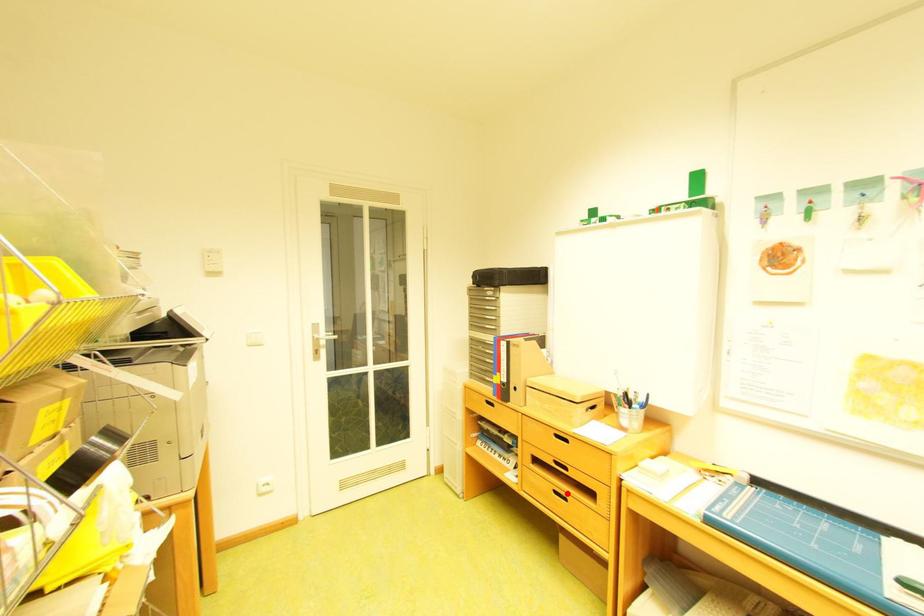
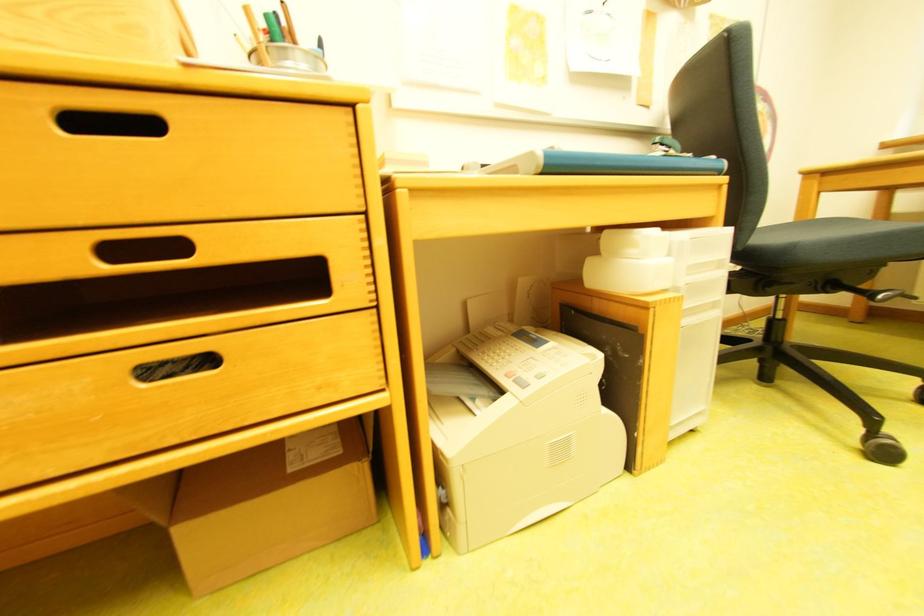
Question: I am providing you with two images of the same scene from different viewpoints. Given a red point in image1, look at the same physical point in image2. Is it:

Choices:
 (A) Closer to the viewpoint
 (B) Farther from the viewpoint

Answer: (A)